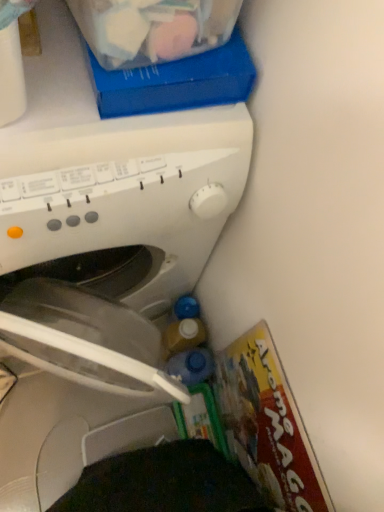
Question: Should I look upward or downward to see blue translucent bottle at lower right?

Choices:
 (A) up
 (B) down

Answer: (B)

Question: Considering the relative sizes of white plastic washing machine at center and translucent plastic storage box at upper center in the image provided, is white plastic washing machine at center smaller than translucent plastic storage box at upper center?

Choices:
 (A) yes
 (B) no

Answer: (B)

Question: Are white plastic washing machine at center and translucent plastic storage box at upper center beside each other?

Choices:
 (A) yes
 (B) no

Answer: (B)

Question: From the image's perspective, would you say white plastic washing machine at center is positioned over translucent plastic storage box at upper center?

Choices:
 (A) yes
 (B) no

Answer: (B)

Question: Does white plastic washing machine at center have a larger size compared to translucent plastic storage box at upper center?

Choices:
 (A) yes
 (B) no

Answer: (A)

Question: Is white plastic washing machine at center positioned before translucent plastic storage box at upper center?

Choices:
 (A) yes
 (B) no

Answer: (A)

Question: From a real-world perspective, is white plastic washing machine at center located higher than translucent plastic storage box at upper center?

Choices:
 (A) yes
 (B) no

Answer: (B)

Question: Is white plastic washing machine at center in contact with blue translucent bottle at lower right?

Choices:
 (A) yes
 (B) no

Answer: (B)

Question: Does white plastic washing machine at center have a smaller size compared to blue translucent bottle at lower right?

Choices:
 (A) yes
 (B) no

Answer: (B)

Question: Does white plastic washing machine at center appear on the right side of blue translucent bottle at lower right?

Choices:
 (A) no
 (B) yes

Answer: (A)

Question: Is white plastic washing machine at center positioned far away from blue translucent bottle at lower right?

Choices:
 (A) yes
 (B) no

Answer: (B)

Question: Can you confirm if white plastic washing machine at center is wider than blue translucent bottle at lower right?

Choices:
 (A) no
 (B) yes

Answer: (B)

Question: Considering the relative sizes of white plastic washing machine at center and blue translucent bottle at lower right in the image provided, is white plastic washing machine at center taller than blue translucent bottle at lower right?

Choices:
 (A) no
 (B) yes

Answer: (B)

Question: Is white plastic washing machine at center located outside matte cardboard magazine at lower right?

Choices:
 (A) yes
 (B) no

Answer: (A)